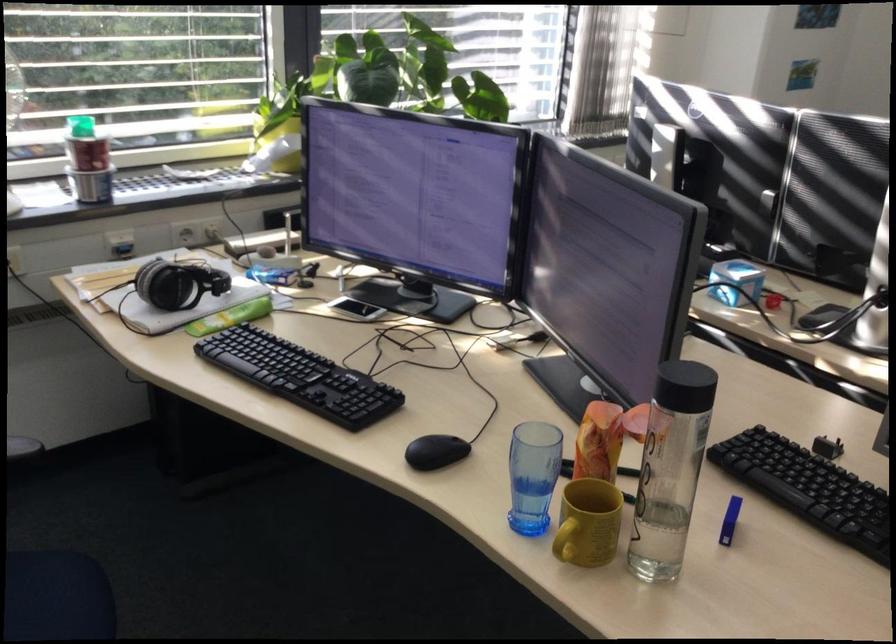
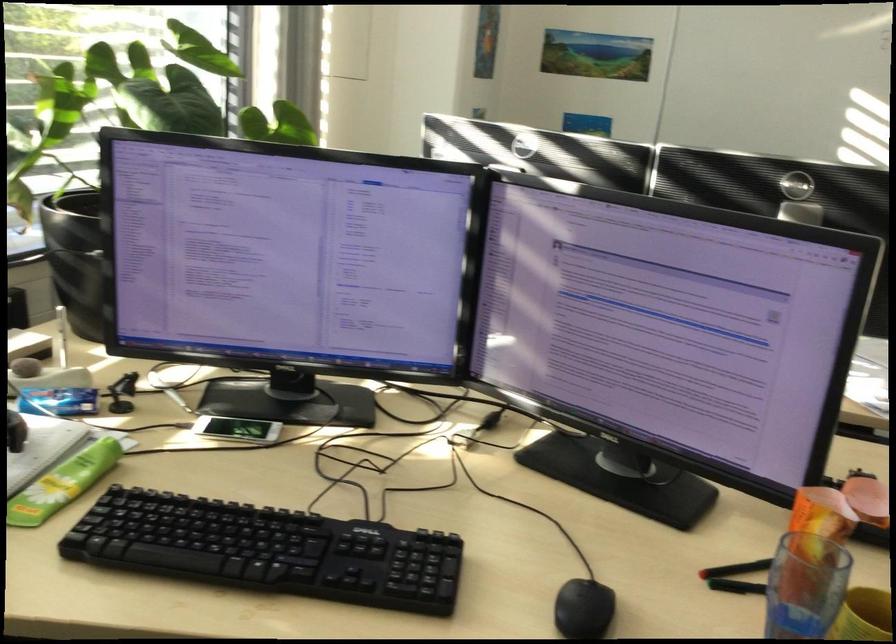
In the second image, find the point that corresponds to (591,482) in the first image.

(805, 585)